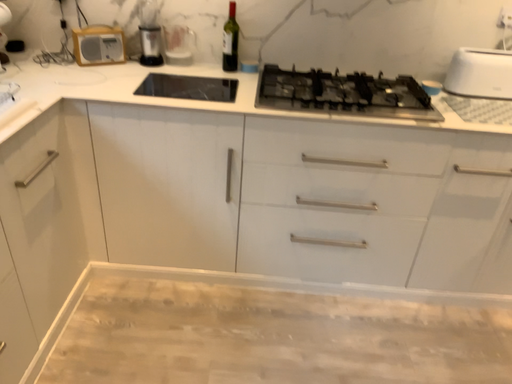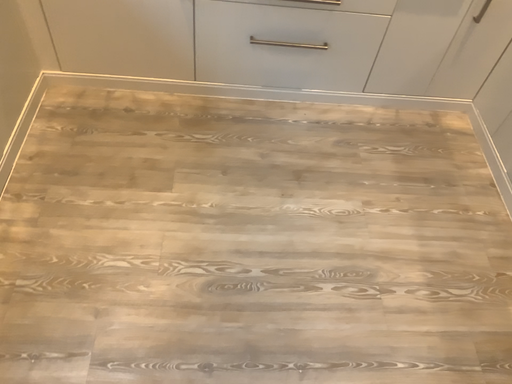
Question: Which way did the camera rotate in the video?

Choices:
 (A) rotated upward
 (B) rotated downward

Answer: (B)